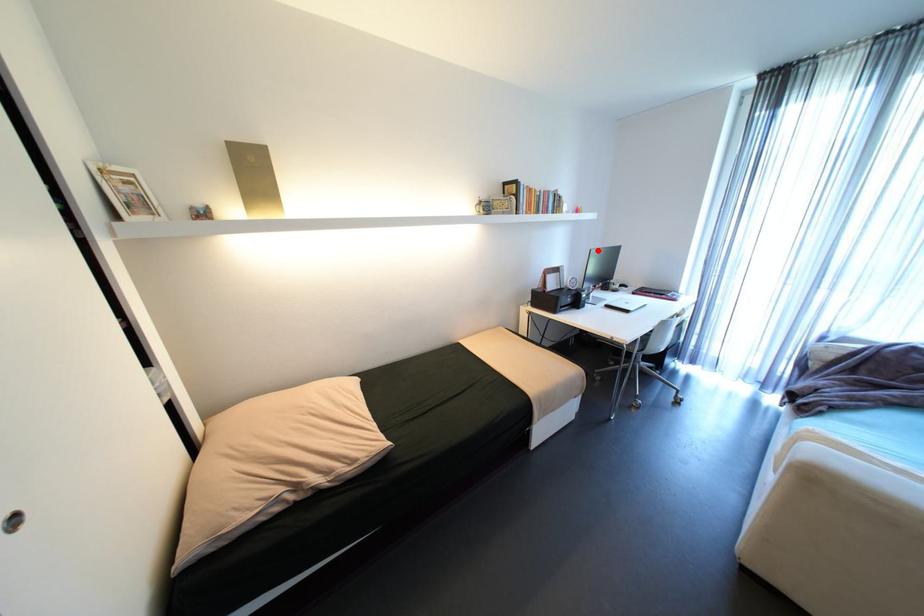
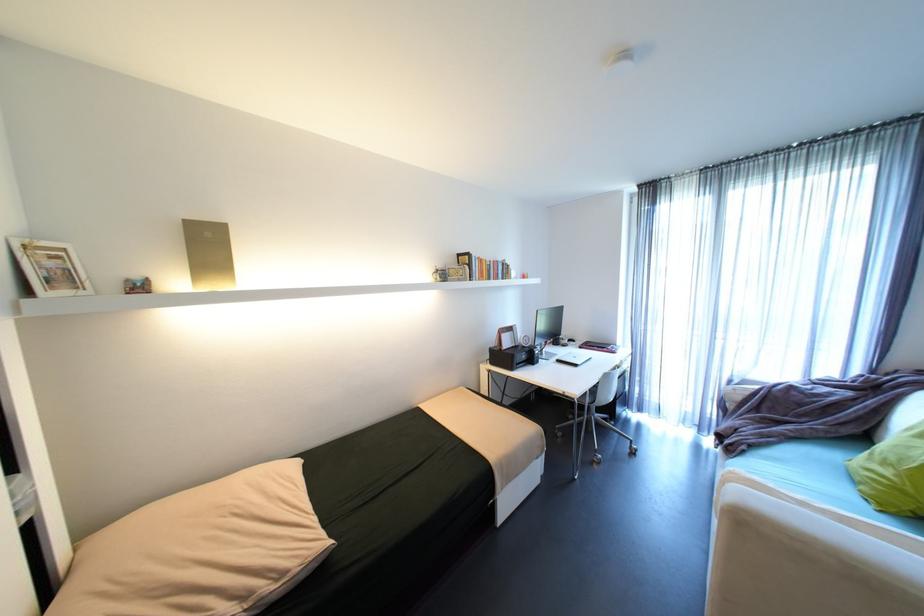
Where in the second image is the point corresponding to the highlighted location from the first image?

(544, 310)